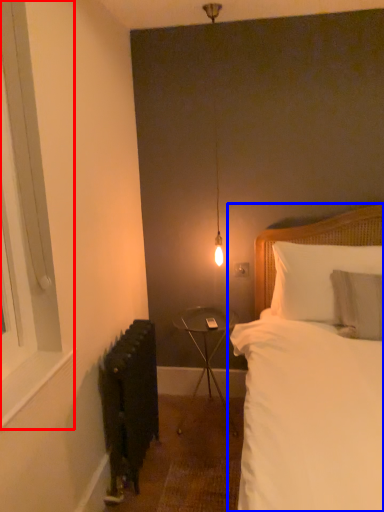
Question: Which point is closer to the camera, window (highlighted by a red box) or bed (highlighted by a blue box)?

Choices:
 (A) window
 (B) bed

Answer: (B)